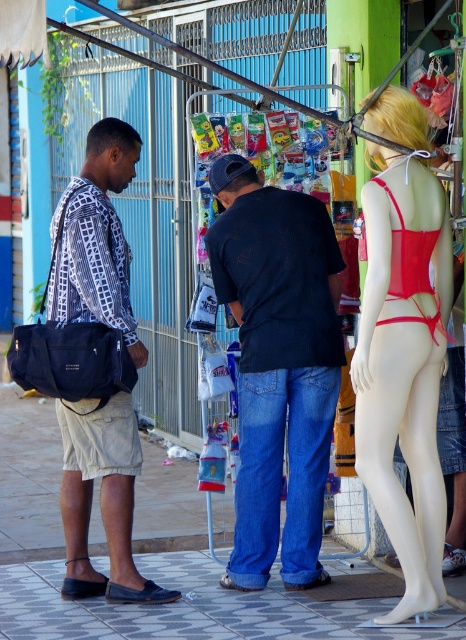
Question: Among these points, which one is farthest from the camera?

Choices:
 (A) (363, 355)
 (B) (204, 556)

Answer: (B)

Question: Which of the following is the closest to the observer?

Choices:
 (A) matte red bikini top at right
 (B) dark blue jeans at center
 (C) gray tile pavement at lower center
 (D) matte black shirt at left

Answer: (C)

Question: Can you confirm if dark blue jeans at center is positioned below matte red bikini top at right?

Choices:
 (A) no
 (B) yes

Answer: (B)

Question: Is red matte bikini at right closer to the viewer compared to matte black shirt at left?

Choices:
 (A) yes
 (B) no

Answer: (A)

Question: Which point is farther to the camera?

Choices:
 (A) red matte bikini at right
 (B) dark blue jeans at center
 (C) gray tile pavement at lower center
 (D) matte black shirt at left

Answer: (B)

Question: Does red matte bikini at right appear on the right side of gray tile pavement at lower center?

Choices:
 (A) yes
 (B) no

Answer: (A)